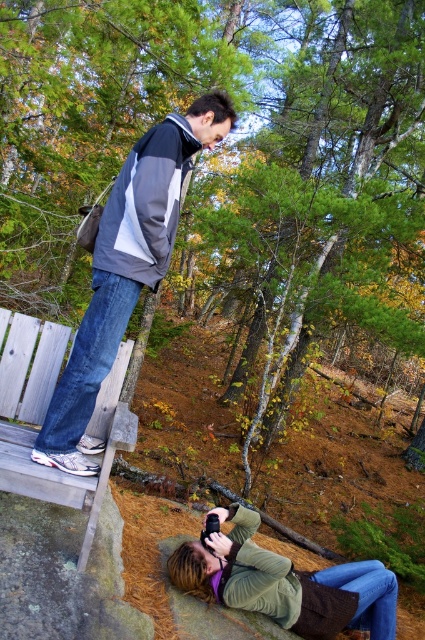
Can you confirm if gray/white jacket at center is wider than green fuzzy jacket at lower center?

In fact, gray/white jacket at center might be narrower than green fuzzy jacket at lower center.

Consider the image. Does gray/white jacket at center lie behind green fuzzy jacket at lower center?

Answer: That is False.

You are a GUI agent. You are given a task and a screenshot of the screen. Output one action in this format:
    pyautogui.click(x=<x>, y=<y>)
    Task: Click on the gray/white jacket at center
    This screenshot has height=640, width=425.
    Given the screenshot: What is the action you would take?
    coord(125,269)

Does gray/white jacket at center appear under gray wood bench at lower left?

No.

Is gray/white jacket at center taller than gray wood bench at lower left?

Yes.

This screenshot has width=425, height=640. I want to click on gray/white jacket at center, so click(x=125, y=269).

Is green fuzzy jacket at lower center to the left of gray wood bench at lower left from the viewer's perspective?

Incorrect, green fuzzy jacket at lower center is not on the left side of gray wood bench at lower left.

Between green fuzzy jacket at lower center and gray wood bench at lower left, which one appears on the left side from the viewer's perspective?

gray wood bench at lower left

Is point (377, 566) closer to camera compared to point (51, 324)?

That is False.

Where is `green fuzzy jacket at lower center`? The height and width of the screenshot is (640, 425). green fuzzy jacket at lower center is located at coordinates (x=283, y=582).